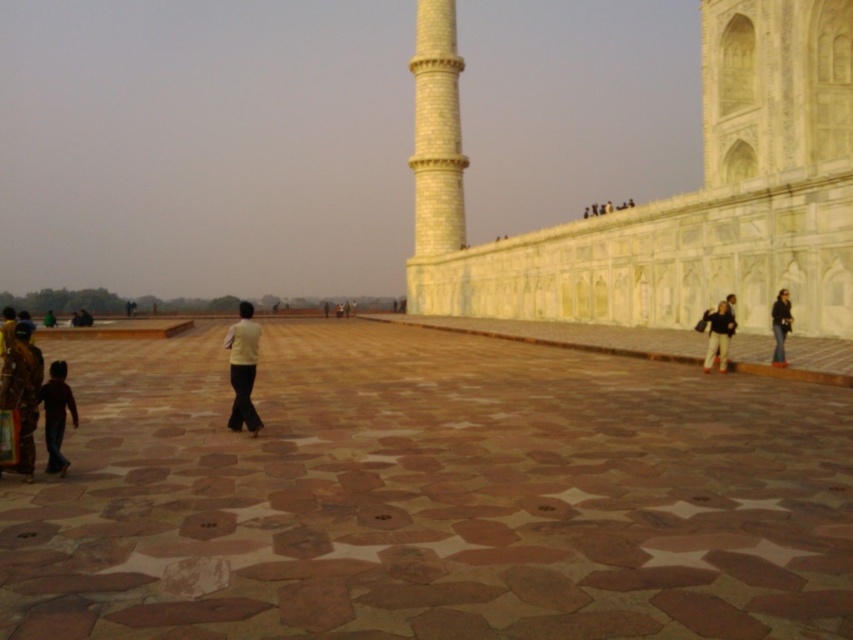
Does brown stone plaza at center appear under camouflage fabric jacket at lower left?

Indeed, brown stone plaza at center is positioned under camouflage fabric jacket at lower left.

Does point (350, 465) lie behind point (35, 403)?

Yes, it is.

Identify the location of brown stone plaza at center. (430, 497).

Is camouflage fabric jacket at lower left to the left of light brown leather jacket at lower right from the viewer's perspective?

Correct, you'll find camouflage fabric jacket at lower left to the left of light brown leather jacket at lower right.

Between camouflage fabric jacket at lower left and light brown leather jacket at lower right, which one has less height?

Standing shorter between the two is light brown leather jacket at lower right.

Where is `camouflage fabric jacket at lower left`? Image resolution: width=853 pixels, height=640 pixels. camouflage fabric jacket at lower left is located at coordinates (21, 392).

Which is below, camouflage fabric jacket at lower left or green fabric person at lower left?

camouflage fabric jacket at lower left is below.

Is camouflage fabric jacket at lower left to the right of green fabric person at lower left from the viewer's perspective?

Correct, you'll find camouflage fabric jacket at lower left to the right of green fabric person at lower left.

Find the location of a particular element. Image resolution: width=853 pixels, height=640 pixels. camouflage fabric jacket at lower left is located at coordinates [21, 392].